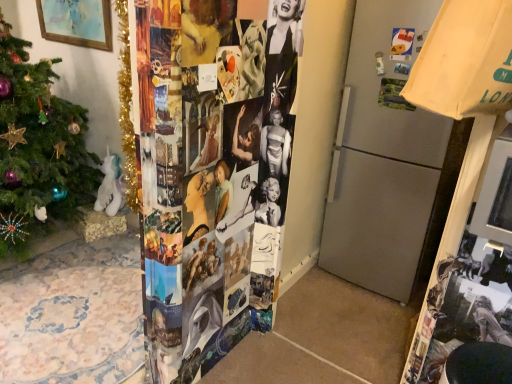
Question: Can gold tinsel christmas tree at left be found inside wooden framed painting at upper left?

Choices:
 (A) no
 (B) yes

Answer: (A)

Question: From a real-world perspective, is wooden framed painting at upper left located beneath gold tinsel christmas tree at left?

Choices:
 (A) yes
 (B) no

Answer: (B)

Question: Is wooden framed painting at upper left positioned beyond the bounds of gold tinsel christmas tree at left?

Choices:
 (A) no
 (B) yes

Answer: (B)

Question: Can you confirm if wooden framed painting at upper left is taller than gold tinsel christmas tree at left?

Choices:
 (A) no
 (B) yes

Answer: (A)

Question: Does wooden framed painting at upper left have a smaller size compared to gold tinsel christmas tree at left?

Choices:
 (A) no
 (B) yes

Answer: (A)

Question: Is wooden framed painting at upper left at the left side of gold tinsel christmas tree at left?

Choices:
 (A) yes
 (B) no

Answer: (A)

Question: From a real-world perspective, is gold tinsel christmas tree at left physically above wooden framed painting at upper left?

Choices:
 (A) no
 (B) yes

Answer: (A)

Question: Does gold tinsel christmas tree at left have a greater height compared to wooden framed painting at upper left?

Choices:
 (A) yes
 (B) no

Answer: (A)

Question: Does gold tinsel christmas tree at left have a lesser height compared to wooden framed painting at upper left?

Choices:
 (A) yes
 (B) no

Answer: (B)

Question: Is the depth of gold tinsel christmas tree at left less than that of wooden framed painting at upper left?

Choices:
 (A) yes
 (B) no

Answer: (A)

Question: Is gold tinsel christmas tree at left positioned far away from wooden framed painting at upper left?

Choices:
 (A) no
 (B) yes

Answer: (B)

Question: Considering the relative sizes of gold tinsel christmas tree at left and wooden framed painting at upper left in the image provided, is gold tinsel christmas tree at left thinner than wooden framed painting at upper left?

Choices:
 (A) yes
 (B) no

Answer: (B)

Question: Is gold tinsel christmas tree at left spatially inside wooden framed painting at upper left, or outside of it?

Choices:
 (A) inside
 (B) outside

Answer: (B)